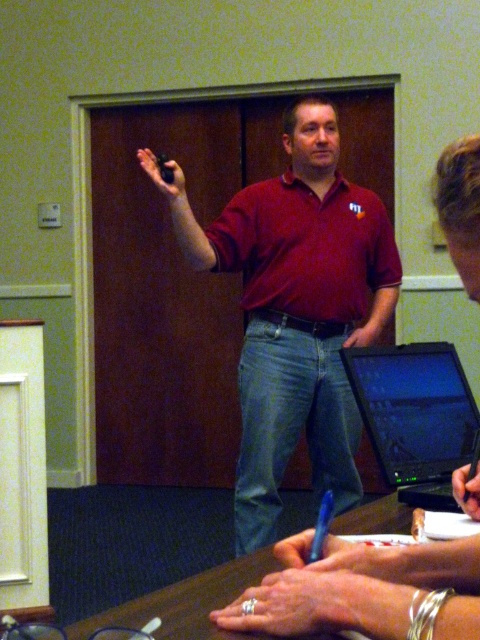
Question: Based on their relative distances, which object is farther from the brown wooden table at lower center?

Choices:
 (A) black glossy laptop at center
 (B) blue plastic pen at lower center

Answer: (A)

Question: Which of these objects is positioned farthest from the matte red shirt at center?

Choices:
 (A) blue plastic pen at lower center
 (B) brown wooden table at lower center

Answer: (B)

Question: Based on their relative distances, which object is farther from the blue plastic pen at lower center?

Choices:
 (A) matte red shirt at center
 (B) brown wooden table at lower center
 (C) black glossy laptop at center

Answer: (A)

Question: Is matte red shirt at center bigger than brown wooden table at lower center?

Choices:
 (A) yes
 (B) no

Answer: (A)

Question: From the image, what is the correct spatial relationship of black glossy laptop at center in relation to blue plastic pen at lower center?

Choices:
 (A) above
 (B) below

Answer: (A)

Question: Is black glossy laptop at center closer to camera compared to brown wooden table at lower center?

Choices:
 (A) no
 (B) yes

Answer: (A)